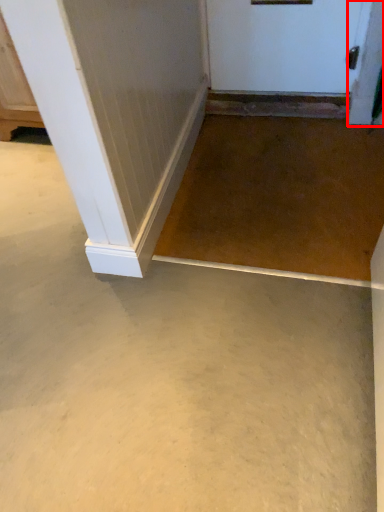
Question: From the image's perspective, what is the correct spatial positioning of screen door (annotated by the red box) in reference to concrete?

Choices:
 (A) below
 (B) above

Answer: (B)